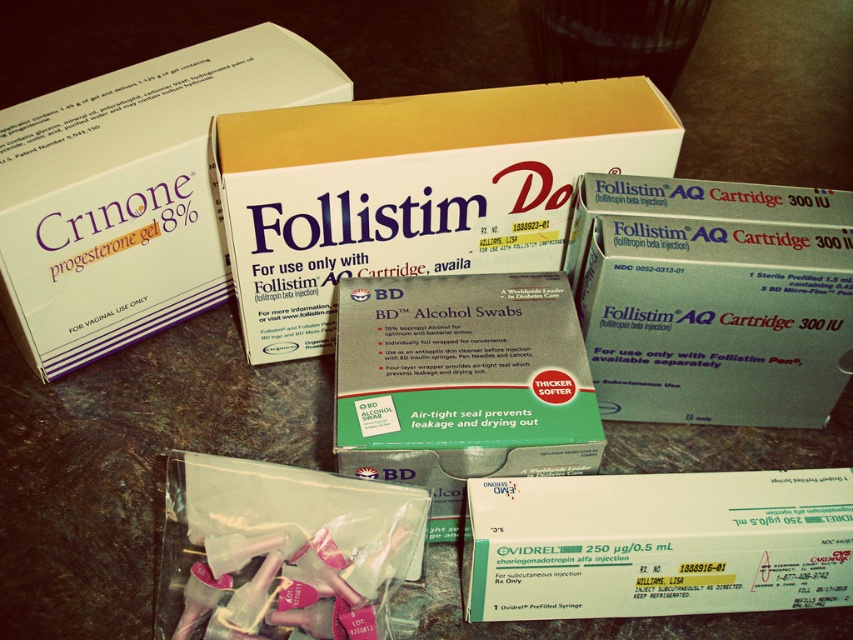
You are a pharmacist arranging items on a shelf. You have two points marked on the shelf where you need to place a new medication box. The first point is at coordinates point (633, 330) and the second is at point (676, 500). Which point is closer to you as you face the shelf?

Point (633, 330) is closer to you because it is further to the viewer than point (676, 500).

Please provide the coordinates of the matte white box at center in the image. The coordinates should be in the format of a point with x and y values between 0 and 1, where the origin is the bottom left corner of the image. The options are as follows. A. Point at 0.5, 0.5. B. Point at 0.469, 0.837. C. Point at 0.6, 0.7. D. Point at 0.3, 0.9. Please select the correct option.

The coordinates of the matte white box at center are point B. Point at (712, 300).

You are a pharmacist organizing medications on a shelf. You need to place a new medication box exactly at the coordinates given for the white cardboard box at center. What are the coordinates where you should place the new box?

The coordinates for the white cardboard box at center are point (x=413, y=189). Place the new medication box at these coordinates.